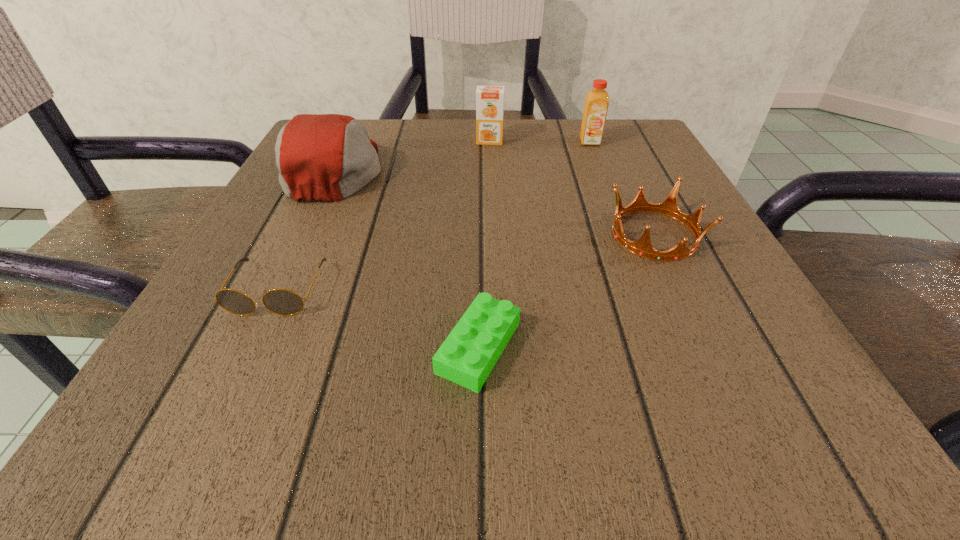
Where is `the right orange juice`? Image resolution: width=960 pixels, height=540 pixels. the right orange juice is located at coordinates (597, 100).

This screenshot has width=960, height=540. In order to click on the left orange juice in this screenshot , I will do `click(489, 99)`.

The width and height of the screenshot is (960, 540). In order to click on cap in this screenshot , I will do `click(328, 157)`.

Where is `the third shortest object`? This screenshot has height=540, width=960. the third shortest object is located at coordinates (669, 207).

At what (x,y) coordinates should I click in order to perform the action: click on the fourth farthest object. Please return your answer as a coordinate pair (x, y). Looking at the image, I should click on (669, 207).

The width and height of the screenshot is (960, 540). What are the coordinates of `the second shortest object` in the screenshot? It's located at (283, 302).

Identify the location of the shortest object. This screenshot has height=540, width=960. (467, 356).

This screenshot has width=960, height=540. I want to click on vacant space situated 0.280m on the front and back of the right orange juice, so click(x=624, y=228).

You are a GUI agent. You are given a task and a screenshot of the screen. Output one action in this format:
    pyautogui.click(x=<x>, y=<y>)
    Task: Click on the free location located on the front of the left orange juice
    
    Given the screenshot: What is the action you would take?
    pyautogui.click(x=492, y=233)

At what (x,y) coordinates should I click in order to perform the action: click on vacant region located on the front-facing side of the cap. Please return your answer as a coordinate pair (x, y). The width and height of the screenshot is (960, 540). Looking at the image, I should click on (441, 170).